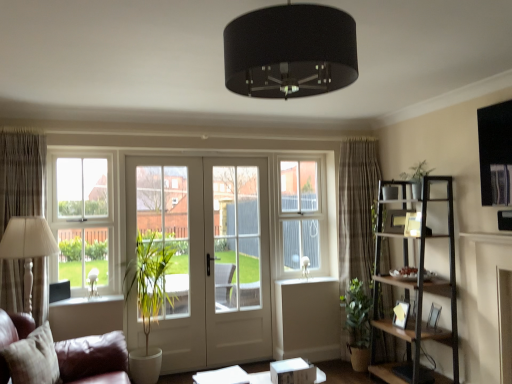
Question: Is black fabric lampshade at center in contact with matte wooden picture frame at upper right, placed as the third picture frame when sorted from bottom to top?

Choices:
 (A) yes
 (B) no

Answer: (B)

Question: Does black fabric lampshade at center have a lesser width compared to matte wooden picture frame at upper right, placed as the third picture frame when sorted from bottom to top?

Choices:
 (A) yes
 (B) no

Answer: (B)

Question: Does black fabric lampshade at center come in front of matte wooden picture frame at upper right, arranged as the 1th picture frame when viewed from the top?

Choices:
 (A) yes
 (B) no

Answer: (A)

Question: Does black fabric lampshade at center have a larger size compared to matte wooden picture frame at upper right, arranged as the 1th picture frame when viewed from the top?

Choices:
 (A) yes
 (B) no

Answer: (A)

Question: Considering the relative positions of black fabric lampshade at center and matte wooden picture frame at upper right, arranged as the 1th picture frame when viewed from the top, in the image provided, is black fabric lampshade at center to the right of matte wooden picture frame at upper right, arranged as the 1th picture frame when viewed from the top, from the viewer's perspective?

Choices:
 (A) yes
 (B) no

Answer: (B)

Question: Considering the relative sizes of black fabric lampshade at center and matte wooden picture frame at upper right, placed as the third picture frame when sorted from bottom to top, in the image provided, is black fabric lampshade at center taller than matte wooden picture frame at upper right, placed as the third picture frame when sorted from bottom to top,?

Choices:
 (A) no
 (B) yes

Answer: (B)

Question: From the image's perspective, is beige fabric pillow at lower left over plaid fabric curtain at right, the second curtain positioned from the left?

Choices:
 (A) no
 (B) yes

Answer: (A)

Question: Considering the relative sizes of beige fabric pillow at lower left and plaid fabric curtain at right, the second curtain positioned from the left, in the image provided, is beige fabric pillow at lower left thinner than plaid fabric curtain at right, the second curtain positioned from the left,?

Choices:
 (A) no
 (B) yes

Answer: (B)

Question: Is beige fabric pillow at lower left shorter than plaid fabric curtain at right, the first curtain from the back?

Choices:
 (A) yes
 (B) no

Answer: (A)

Question: Can you confirm if beige fabric pillow at lower left is positioned to the right of plaid fabric curtain at right, positioned as the first curtain in right-to-left order?

Choices:
 (A) no
 (B) yes

Answer: (A)

Question: Is beige fabric pillow at lower left touching plaid fabric curtain at right, the second curtain from the front?

Choices:
 (A) yes
 (B) no

Answer: (B)

Question: Is beige fabric pillow at lower left completely or partially outside of plaid fabric curtain at right, the second curtain positioned from the left?

Choices:
 (A) yes
 (B) no

Answer: (A)

Question: Can you confirm if white plastic window screen at center is taller than wooden picture frame at right, the 2th picture frame positioned from the top?

Choices:
 (A) yes
 (B) no

Answer: (A)